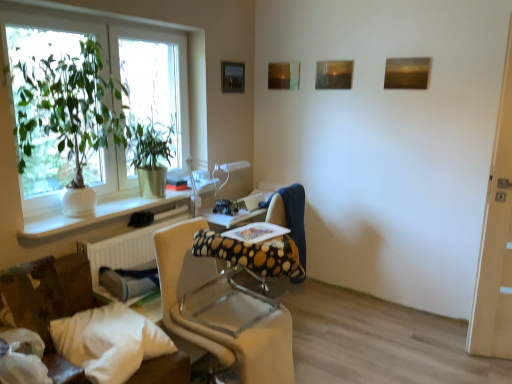
Question: From a real-world perspective, is white textured radiator at lower left physically located above or below matte wooden picture frame at upper center, the third picture frame viewed from the right?

Choices:
 (A) above
 (B) below

Answer: (B)

Question: In terms of height, does white textured radiator at lower left look taller or shorter compared to matte wooden picture frame at upper center, the third picture frame viewed from the right?

Choices:
 (A) short
 (B) tall

Answer: (B)

Question: Which object is positioned closest to the green glossy plant at left, the 2th houseplant from the front?

Choices:
 (A) metallic rectangular frame at upper center, the fourth picture frame in the right-to-left sequence
 (B) transparent glass door at right
 (C) polka dot fabric swivel chair at center
 (D) white textured radiator at lower left
 (E) white ceramic pot at left

Answer: (E)

Question: Estimate the real-world distances between objects in this image. Which object is closer to the matte wooden picture frame at upper center, positioned as the third picture frame in left-to-right order?

Choices:
 (A) transparent glass door at right
 (B) beige fabric chair at center
 (C) white fabric pillow at lower left
 (D) white textured radiator at lower left
 (E) wooden textured painting at upper right, placed as the 4th picture frame when sorted from left to right

Answer: (E)